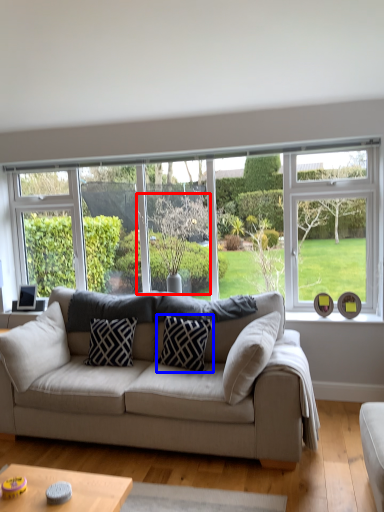
Question: Which object appears farthest to the camera in this image, tree (highlighted by a red box) or pillow (highlighted by a blue box)?

Choices:
 (A) tree
 (B) pillow

Answer: (A)